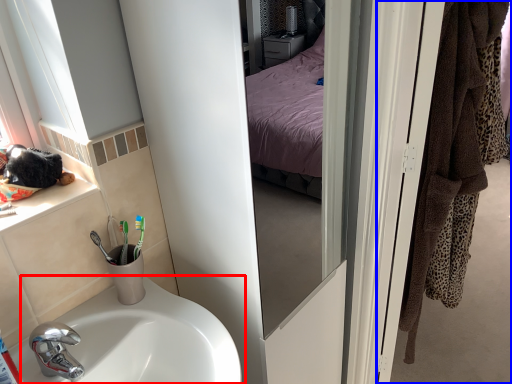
Question: Which object appears farthest to the camera in this image, sink (highlighted by a red box) or door (highlighted by a blue box)?

Choices:
 (A) sink
 (B) door

Answer: (B)